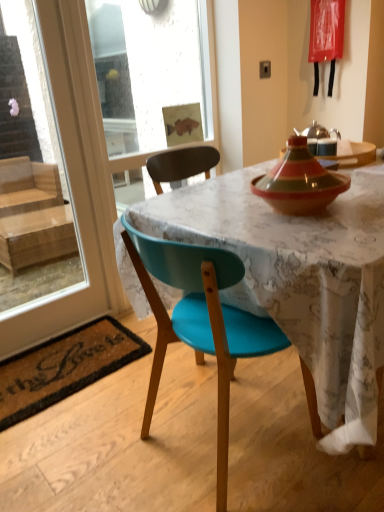
Question: Is teal plastic chair at center touching coir mat at lower left?

Choices:
 (A) yes
 (B) no

Answer: (B)

Question: Considering the relative positions of teal plastic chair at center and coir mat at lower left in the image provided, is teal plastic chair at center in front of coir mat at lower left?

Choices:
 (A) no
 (B) yes

Answer: (B)

Question: Considering the relative sizes of teal plastic chair at center and coir mat at lower left in the image provided, is teal plastic chair at center wider than coir mat at lower left?

Choices:
 (A) yes
 (B) no

Answer: (A)

Question: Is teal plastic chair at center at the left side of coir mat at lower left?

Choices:
 (A) no
 (B) yes

Answer: (A)

Question: From a real-world perspective, is teal plastic chair at center on coir mat at lower left?

Choices:
 (A) no
 (B) yes

Answer: (B)

Question: From a real-world perspective, is teal plastic chair at center located beneath coir mat at lower left?

Choices:
 (A) yes
 (B) no

Answer: (B)

Question: From the image's perspective, is transparent glass screen door at upper left on matte ceramic tagine at upper right?

Choices:
 (A) yes
 (B) no

Answer: (B)

Question: Does transparent glass screen door at upper left have a greater width compared to matte ceramic tagine at upper right?

Choices:
 (A) yes
 (B) no

Answer: (B)

Question: Is transparent glass screen door at upper left thinner than matte ceramic tagine at upper right?

Choices:
 (A) yes
 (B) no

Answer: (A)

Question: From a real-world perspective, is transparent glass screen door at upper left over matte ceramic tagine at upper right?

Choices:
 (A) yes
 (B) no

Answer: (B)

Question: Is transparent glass screen door at upper left outside of matte ceramic tagine at upper right?

Choices:
 (A) yes
 (B) no

Answer: (A)

Question: Is the position of transparent glass screen door at upper left less distant than that of matte ceramic tagine at upper right?

Choices:
 (A) no
 (B) yes

Answer: (B)

Question: From a real-world perspective, is matte ceramic tagine at upper right physically below teal plastic chair at center?

Choices:
 (A) no
 (B) yes

Answer: (A)